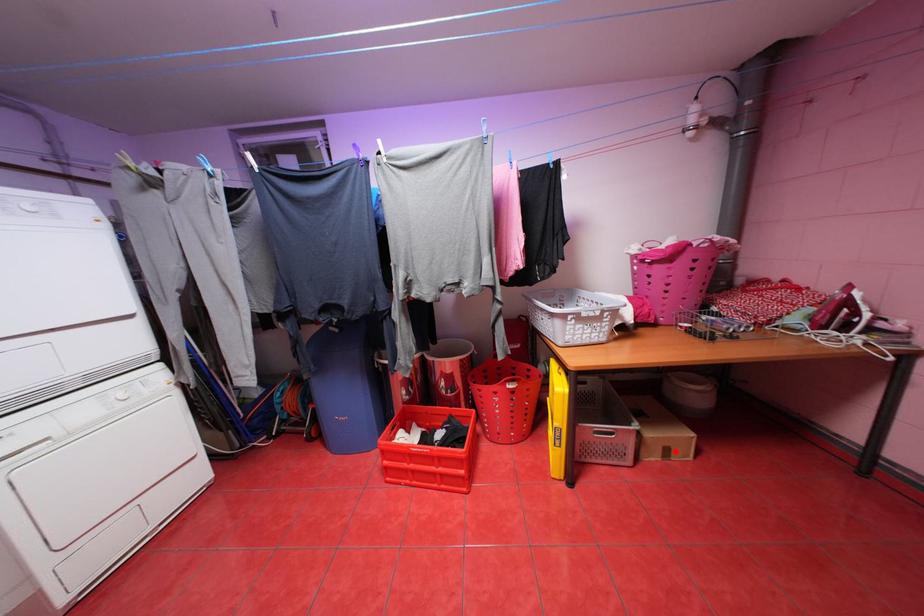
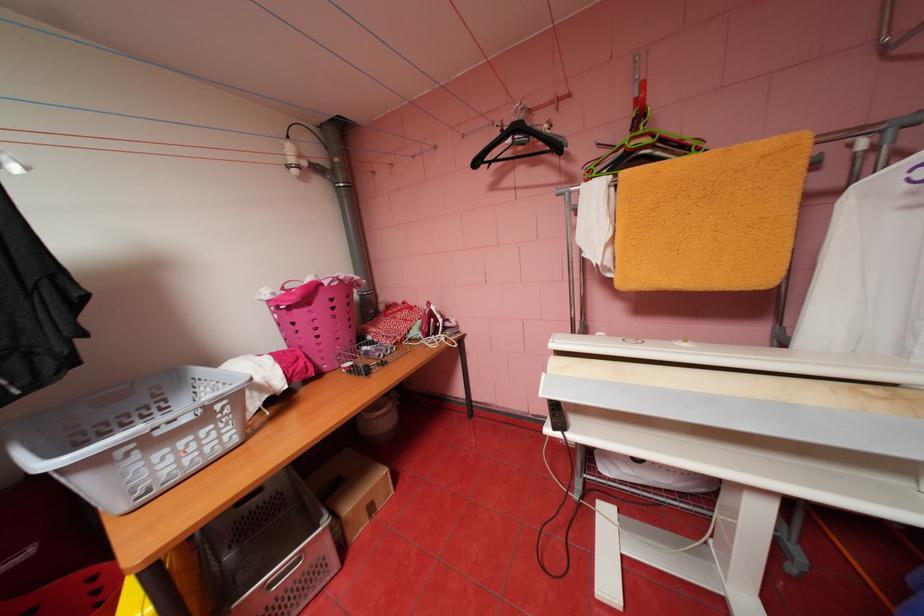
Question: I am providing you with two images of the same scene from different viewpoints. In image1, a red point is highlighted. Considering the same 3D point in image2, which of the following is correct?

Choices:
 (A) It is closer
 (B) It is farther

Answer: (A)